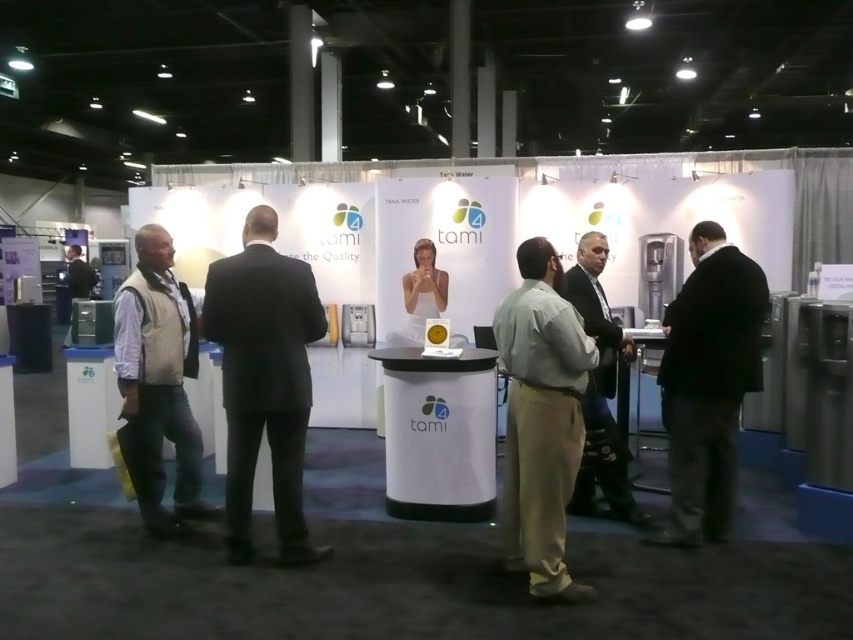
You are attending the Tami booth at the exhibition. There is a black wool suit at right displayed on a mannequin. If you want to take a photo of the suit without blocking the Tami logo on the banner, where should you stand relative to the suit?

Since the black wool suit at right is located at point [708,381], you should position yourself to the left of the suit to avoid blocking the Tami logo on the banner.

You are organizing an event and need to place a large banner between the black suit at center and the black wool suit at right. Which object should you position the banner closer to if you want to maximize the available space?

The black wool suit at right occupies more space than the black suit at center, so positioning the banner closer to the black suit at center would leave more space for the banner.